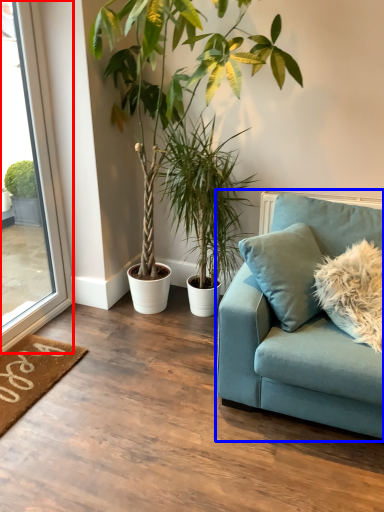
Question: Which point is further to the camera, window (highlighted by a red box) or studio couch (highlighted by a blue box)?

Choices:
 (A) window
 (B) studio couch

Answer: (A)